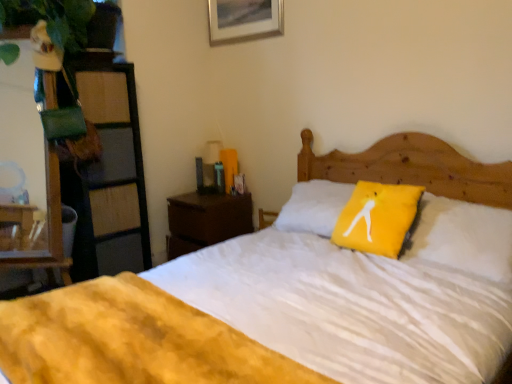
Question: Considering the relative sizes of metallic silver picture frame at upper center and white soft bed at center in the image provided, is metallic silver picture frame at upper center thinner than white soft bed at center?

Choices:
 (A) yes
 (B) no

Answer: (A)

Question: Is metallic silver picture frame at upper center to the left of white soft bed at center from the viewer's perspective?

Choices:
 (A) yes
 (B) no

Answer: (A)

Question: Can you confirm if metallic silver picture frame at upper center is wider than white soft bed at center?

Choices:
 (A) no
 (B) yes

Answer: (A)

Question: Is metallic silver picture frame at upper center taller than white soft bed at center?

Choices:
 (A) yes
 (B) no

Answer: (B)

Question: Is metallic silver picture frame at upper center oriented towards white soft bed at center?

Choices:
 (A) no
 (B) yes

Answer: (A)

Question: Is the position of metallic silver picture frame at upper center more distant than that of white soft bed at center?

Choices:
 (A) yes
 (B) no

Answer: (A)

Question: From a real-world perspective, is yellow fabric pillow at center beneath white soft bed at center?

Choices:
 (A) yes
 (B) no

Answer: (B)

Question: From the image's perspective, does yellow fabric pillow at center appear lower than white soft bed at center?

Choices:
 (A) yes
 (B) no

Answer: (B)

Question: Considering the relative sizes of yellow fabric pillow at center and white soft bed at center in the image provided, is yellow fabric pillow at center smaller than white soft bed at center?

Choices:
 (A) yes
 (B) no

Answer: (A)

Question: Can you confirm if yellow fabric pillow at center is shorter than white soft bed at center?

Choices:
 (A) yes
 (B) no

Answer: (A)

Question: Are yellow fabric pillow at center and white soft bed at center making contact?

Choices:
 (A) yes
 (B) no

Answer: (B)

Question: Is yellow fabric pillow at center positioned before white soft bed at center?

Choices:
 (A) no
 (B) yes

Answer: (A)

Question: Is white soft bed at center aimed at brown wood nightstand at center?

Choices:
 (A) yes
 (B) no

Answer: (B)